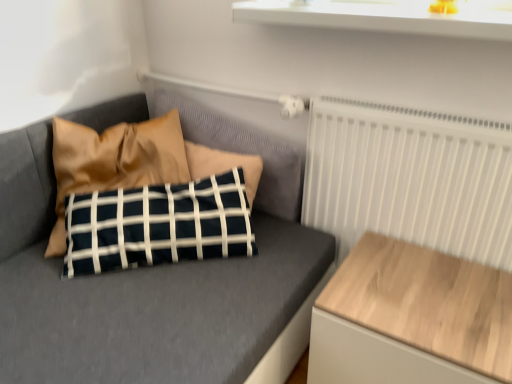
What do you see at coordinates (411, 318) in the screenshot? I see `wooden table at right` at bounding box center [411, 318].

What do you see at coordinates (410, 178) in the screenshot? I see `white matte radiator at upper right` at bounding box center [410, 178].

Find the location of `satin brown pillow at upper left`. satin brown pillow at upper left is located at coordinates pyautogui.click(x=114, y=161).

Locate an element on the screen. Image resolution: width=512 pixels, height=384 pixels. matte black pillow at center is located at coordinates (150, 279).

Looking at this image, is white matte radiator at upper right positioned with its back to matte black pillow at center?

No.

Is the depth of white matte radiator at upper right less than that of matte black pillow at center?

Yes, white matte radiator at upper right is closer to the viewer.

Locate an element on the screen. radiator in front of the matte black pillow at center is located at coordinates (410, 178).

Which of these two, white matte radiator at upper right or matte black pillow at center, is bigger?

With larger size is matte black pillow at center.

Is wooden table at right positioned far away from white matte radiator at upper right?

Actually, wooden table at right and white matte radiator at upper right are a little close together.

Is wooden table at right situated inside white matte radiator at upper right or outside?

wooden table at right exists outside the volume of white matte radiator at upper right.

Can you confirm if wooden table at right is shorter than white matte radiator at upper right?

Indeed, wooden table at right has a lesser height compared to white matte radiator at upper right.

Is wooden table at right bigger or smaller than white matte radiator at upper right?

In the image, wooden table at right appears to be larger than white matte radiator at upper right.

Is satin brown pillow at upper left surrounding matte black pillow at center?

No.

Are satin brown pillow at upper left and matte black pillow at center beside each other?

No, satin brown pillow at upper left is not making contact with matte black pillow at center.

Who is bigger, satin brown pillow at upper left or matte black pillow at center?

With larger size is matte black pillow at center.

From a real-world perspective, is satin brown pillow at upper left positioned above or below matte black pillow at center?

From a real-world perspective, satin brown pillow at upper left is physically above matte black pillow at center.

Who is smaller, satin brown pillow at upper left or white glossy window sill at upper center?

white glossy window sill at upper center is smaller.

The width and height of the screenshot is (512, 384). I want to click on pillow on the left of white glossy window sill at upper center, so click(114, 161).

Between satin brown pillow at upper left and white glossy window sill at upper center, which one has larger width?

satin brown pillow at upper left.

What's the angular difference between satin brown pillow at upper left and white glossy window sill at upper center's facing directions?

The facing directions of satin brown pillow at upper left and white glossy window sill at upper center are 49.7 degrees apart.

Is matte black pillow at center smaller than white matte radiator at upper right?

No.

Is matte black pillow at center to the right of white matte radiator at upper right from the viewer's perspective?

In fact, matte black pillow at center is to the left of white matte radiator at upper right.

Is point (31, 371) farther from camera compared to point (370, 224)?

No, it is not.

Find the location of a particular element. The image size is (512, 384). studio couch located below the white glossy window sill at upper center (from the image's perspective) is located at coordinates (150, 279).

From a real-world perspective, is matte black pillow at center located higher than white glossy window sill at upper center?

No, from a real-world perspective, matte black pillow at center is not above white glossy window sill at upper center.

Based on the photo, can you tell me how much matte black pillow at center and white glossy window sill at upper center differ in facing direction?

The angular difference between matte black pillow at center and white glossy window sill at upper center is 41.4 degrees.

Is matte black pillow at center to the left or to the right of white glossy window sill at upper center in the image?

matte black pillow at center is positioned on white glossy window sill at upper center's left side.

Is point (500, 26) closer or farther from the camera than point (268, 184)?

Point (500, 26) appears to be closer to the viewer than point (268, 184).

Is there a large distance between white glossy window sill at upper center and matte black pillow at center?

That's not correct — white glossy window sill at upper center is a little close to matte black pillow at center.

Locate an element on the screen. window sill located above the matte black pillow at center (from the image's perspective) is located at coordinates (379, 18).

Locate an element on the screen. The width and height of the screenshot is (512, 384). radiator above the matte black pillow at center (from a real-world perspective) is located at coordinates (410, 178).

The height and width of the screenshot is (384, 512). I want to click on table in front of the white matte radiator at upper right, so click(411, 318).

Looking at the image, which one is located further to white glossy window sill at upper center, satin brown pillow at upper left or wooden table at right?

wooden table at right is positioned further to the anchor white glossy window sill at upper center.

Based on the photo, looking at the image, which one is located closer to white glossy window sill at upper center, wooden table at right or matte black pillow at center?

Based on the image, matte black pillow at center appears to be nearer to white glossy window sill at upper center.

Looking at the image, which one is located closer to white glossy window sill at upper center, white matte radiator at upper right or wooden table at right?

Based on the image, white matte radiator at upper right appears to be nearer to white glossy window sill at upper center.

Estimate the real-world distances between objects in this image. Which object is closer to wooden table at right, satin brown pillow at upper left or white matte radiator at upper right?

Based on the image, white matte radiator at upper right appears to be nearer to wooden table at right.

When comparing their distances from white matte radiator at upper right, does matte black pillow at center or wooden table at right seem closer?

wooden table at right lies closer to white matte radiator at upper right than the other object.

Considering their positions, is white matte radiator at upper right positioned further to satin brown pillow at upper left than matte black pillow at center?

Among the two, white matte radiator at upper right is located further to satin brown pillow at upper left.

Which object lies further to the anchor point wooden table at right, matte black pillow at center or white glossy window sill at upper center?

The object further to wooden table at right is white glossy window sill at upper center.

Looking at the image, which one is located further to satin brown pillow at upper left, white matte radiator at upper right or white glossy window sill at upper center?

white matte radiator at upper right lies further to satin brown pillow at upper left than the other object.

You are a GUI agent. You are given a task and a screenshot of the screen. Output one action in this format:
    pyautogui.click(x=<x>, y=<y>)
    Task: Click on the studio couch between white glossy window sill at upper center and wooden table at right vertically
    This screenshot has width=512, height=384.
    Given the screenshot: What is the action you would take?
    pyautogui.click(x=150, y=279)

The width and height of the screenshot is (512, 384). Identify the location of radiator between satin brown pillow at upper left and wooden table at right. (410, 178).

This screenshot has width=512, height=384. I want to click on studio couch between satin brown pillow at upper left and white glossy window sill at upper center in the horizontal direction, so click(x=150, y=279).

Locate an element on the screen. This screenshot has width=512, height=384. radiator between matte black pillow at center and wooden table at right is located at coordinates (410, 178).